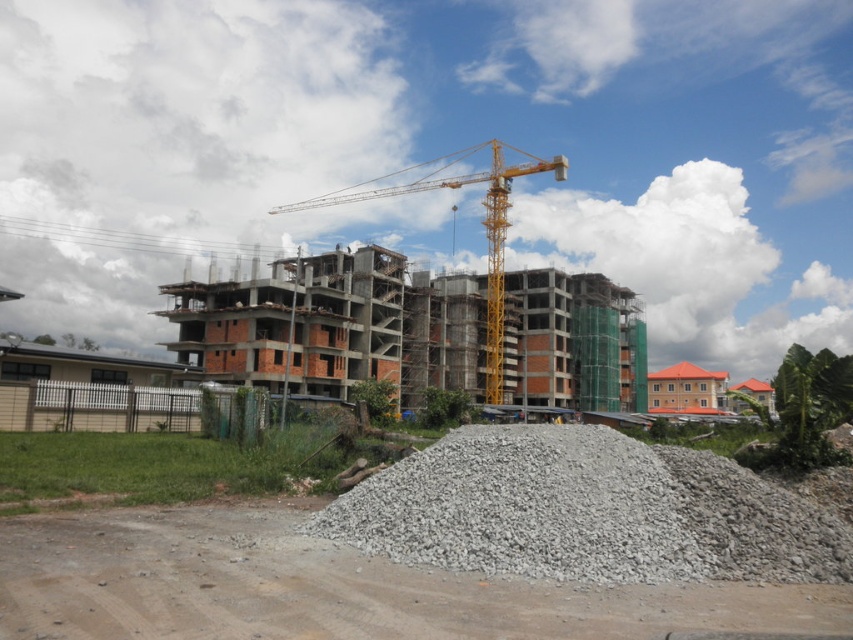
You are a construction worker standing at the edge of the gray gravel at lower center. You need to transport materials to the top floor of the brick building at center. Which object is taller and can you use the crane to reach the top floor?

The brick building at center is taller than the gray gravel at lower center. Yes, you can use the crane to reach the top floor since the crane is positioned over the building and the building itself is tall enough to accommodate the crane reaching its top floor.